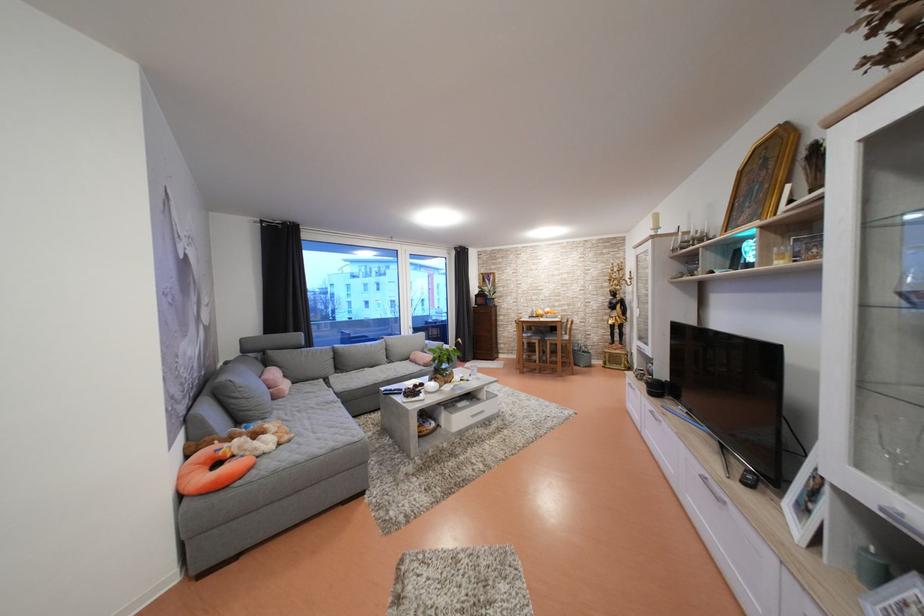
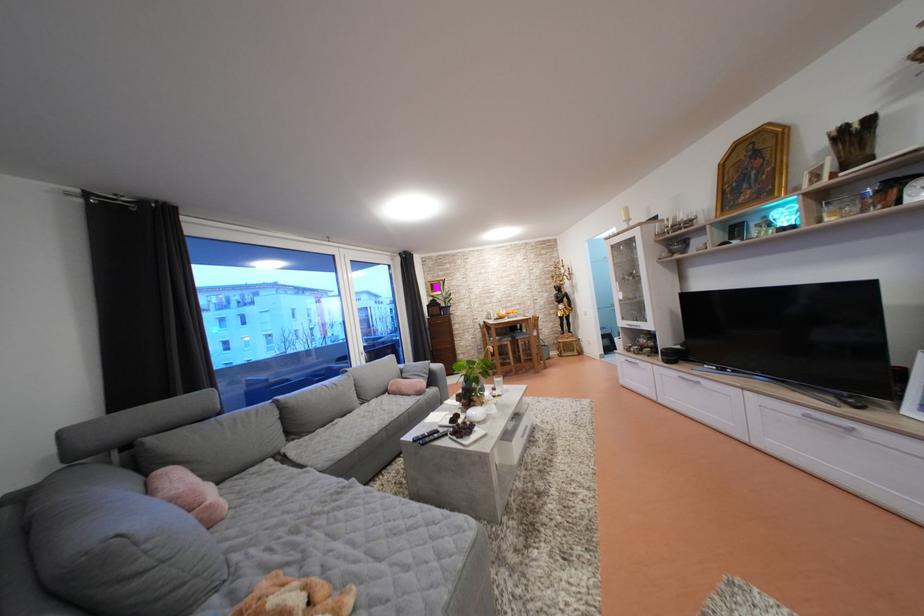
Locate, in the second image, the point that corresponds to [434,347] in the first image.

(408, 371)